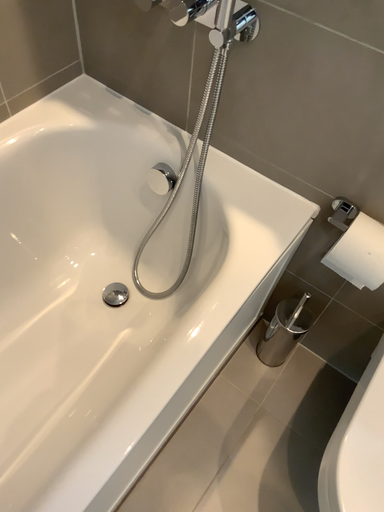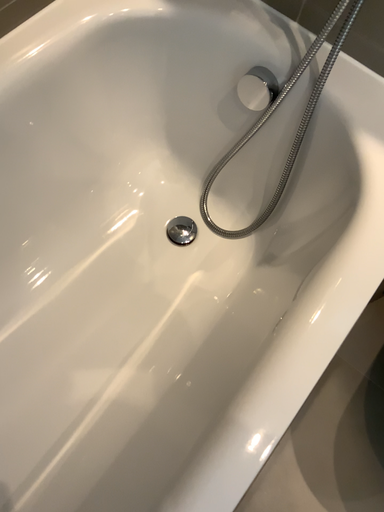
Question: Which way did the camera rotate in the video?

Choices:
 (A) rotated downward
 (B) rotated upward

Answer: (A)